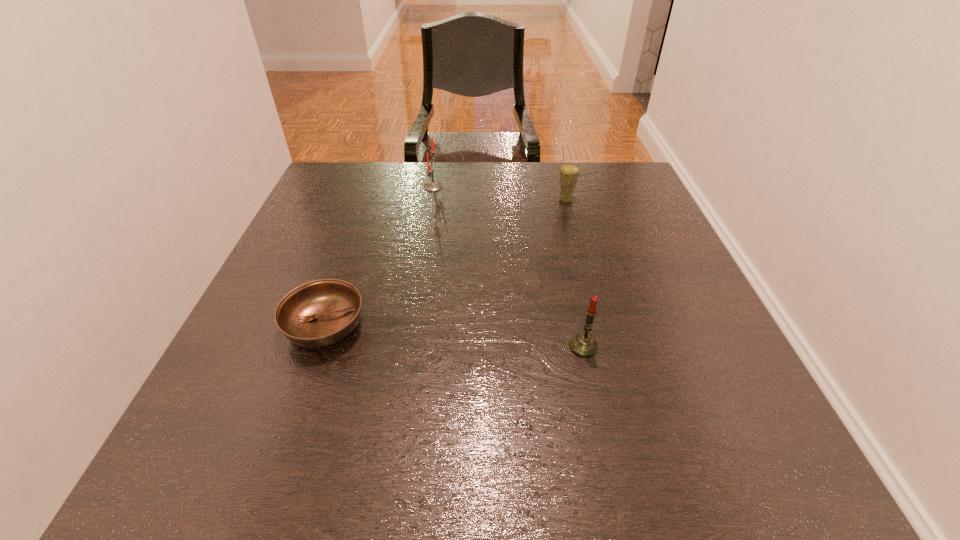
The width and height of the screenshot is (960, 540). In order to click on vacant area that lies between the left candle and the nearer candle in this screenshot , I will do click(x=508, y=267).

Locate an element on the screen. The width and height of the screenshot is (960, 540). vacant area that lies between the nearer candle and the straw for drinking is located at coordinates (574, 274).

At what (x,y) coordinates should I click in order to perform the action: click on vacant space in between the straw for drinking and the right candle. Please return your answer as a coordinate pair (x, y). Image resolution: width=960 pixels, height=540 pixels. Looking at the image, I should click on (574, 274).

Locate an element on the screen. vacant point located between the straw for drinking and the nearer candle is located at coordinates (574, 274).

Locate an element on the screen. This screenshot has height=540, width=960. free space between the leftmost object and the right candle is located at coordinates (454, 336).

Where is `empty space between the straw for drinking and the right candle`? Image resolution: width=960 pixels, height=540 pixels. empty space between the straw for drinking and the right candle is located at coordinates (574, 274).

I want to click on blank region between the soup bowl and the right candle, so click(454, 336).

Identify the location of free space between the leftmost object and the straw for drinking. (445, 264).

Find the location of `vacant space that's between the left candle and the soup bowl`. vacant space that's between the left candle and the soup bowl is located at coordinates (379, 256).

The image size is (960, 540). What are the coordinates of `object that ranks as the second closest to the soup bowl` in the screenshot? It's located at (583, 344).